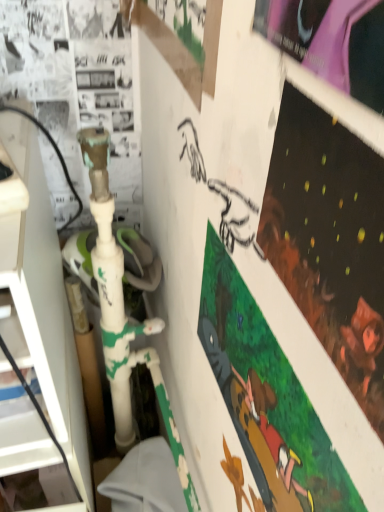
At what (x,y) coordinates should I click in order to perform the action: click on green painted plastic water pipe at left. Please return your answer as a coordinate pair (x, y). The width and height of the screenshot is (384, 512). Looking at the image, I should click on (112, 286).

Describe the element at coordinates (112, 286) in the screenshot. I see `green painted plastic water pipe at left` at that location.

You are a GUI agent. You are given a task and a screenshot of the screen. Output one action in this format:
    pyautogui.click(x=<x>, y=<y>)
    Task: Click on the green painted plastic water pipe at left
    Image resolution: width=384 pixels, height=512 pixels.
    Given the screenshot: What is the action you would take?
    pyautogui.click(x=112, y=286)